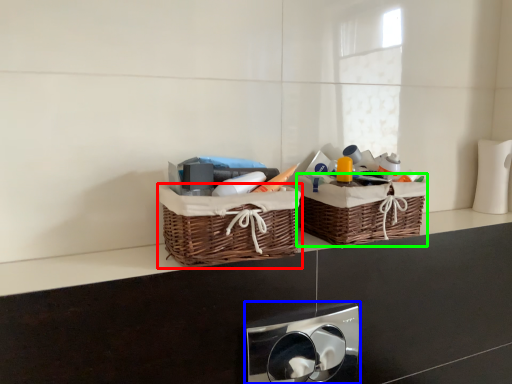
Question: Which object is positioned closest to picnic basket (highlighted by a red box)? Select from appliance (highlighted by a blue box) and picnic basket (highlighted by a green box).

Choices:
 (A) appliance
 (B) picnic basket

Answer: (B)